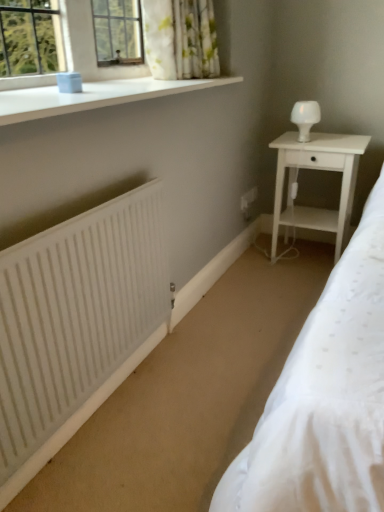
Question: Is the depth of white wood nightstand at right greater than that of white matte radiator at lower left?

Choices:
 (A) yes
 (B) no

Answer: (A)

Question: Can you confirm if white wood nightstand at right is wider than white matte radiator at lower left?

Choices:
 (A) yes
 (B) no

Answer: (A)

Question: Considering the relative sizes of white wood nightstand at right and white matte radiator at lower left in the image provided, is white wood nightstand at right bigger than white matte radiator at lower left?

Choices:
 (A) no
 (B) yes

Answer: (B)

Question: Is the depth of white wood nightstand at right less than that of white matte radiator at lower left?

Choices:
 (A) yes
 (B) no

Answer: (B)

Question: From the image's perspective, is white wood nightstand at right located above white matte radiator at lower left?

Choices:
 (A) no
 (B) yes

Answer: (B)

Question: Which is correct: white matte radiator at lower left is inside white wood nightstand at right, or outside of it?

Choices:
 (A) inside
 (B) outside

Answer: (B)

Question: In terms of width, does white matte radiator at lower left look wider or thinner when compared to white wood nightstand at right?

Choices:
 (A) wide
 (B) thin

Answer: (B)

Question: Considering the relative positions of white matte radiator at lower left and white wood nightstand at right in the image provided, is white matte radiator at lower left to the left or to the right of white wood nightstand at right?

Choices:
 (A) right
 (B) left

Answer: (B)

Question: In the image, is white matte radiator at lower left positioned in front of or behind white wood nightstand at right?

Choices:
 (A) front
 (B) behind

Answer: (A)

Question: Does point (309, 131) appear closer or farther from the camera than point (4, 395)?

Choices:
 (A) farther
 (B) closer

Answer: (A)

Question: Looking at their shapes, would you say white glossy table lamp at upper right is wider or thinner than white matte radiator at lower left?

Choices:
 (A) wide
 (B) thin

Answer: (A)

Question: Is white glossy table lamp at upper right spatially inside white matte radiator at lower left, or outside of it?

Choices:
 (A) outside
 (B) inside

Answer: (A)

Question: From the image's perspective, relative to white matte radiator at lower left, is white glossy table lamp at upper right above or below?

Choices:
 (A) below
 (B) above

Answer: (B)

Question: From a real-world perspective, is white matte radiator at lower left above or below white glossy table lamp at upper right?

Choices:
 (A) below
 (B) above

Answer: (A)

Question: From the image's perspective, relative to white glossy table lamp at upper right, is white matte radiator at lower left above or below?

Choices:
 (A) above
 (B) below

Answer: (B)